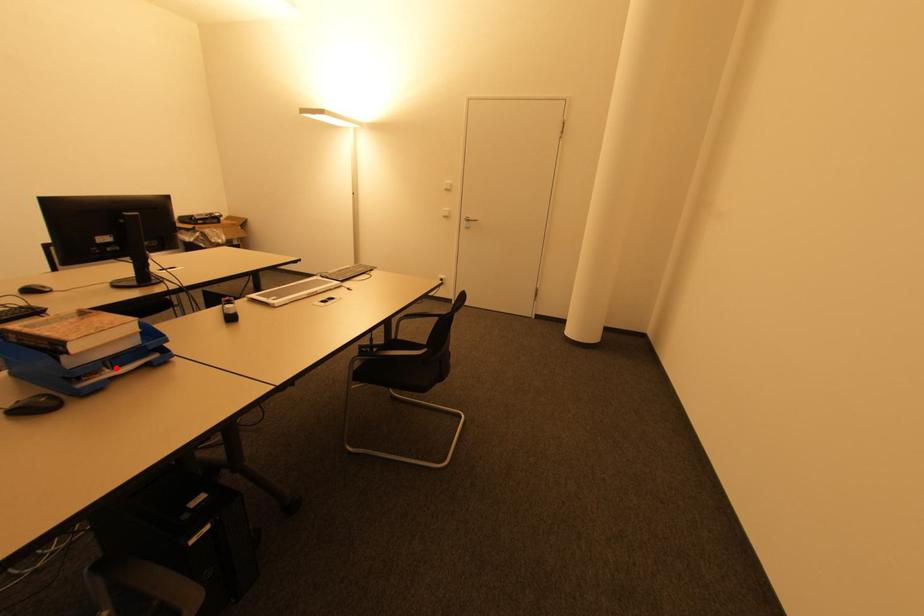
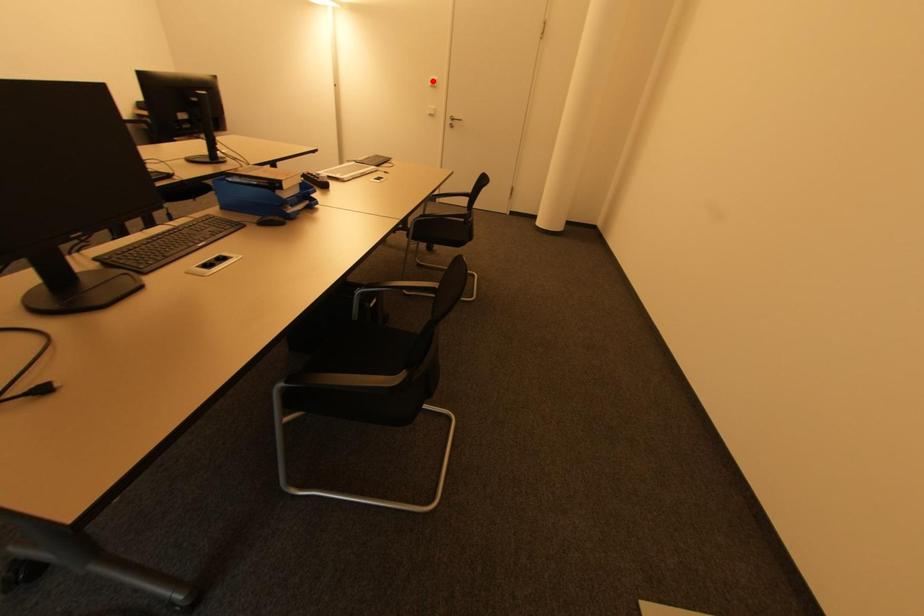
I am providing you with two images of the same scene from different viewpoints. A red point is marked on the first image and another point is marked on the second image. Is the red point in image1 aligned with the point shown in image2?

No